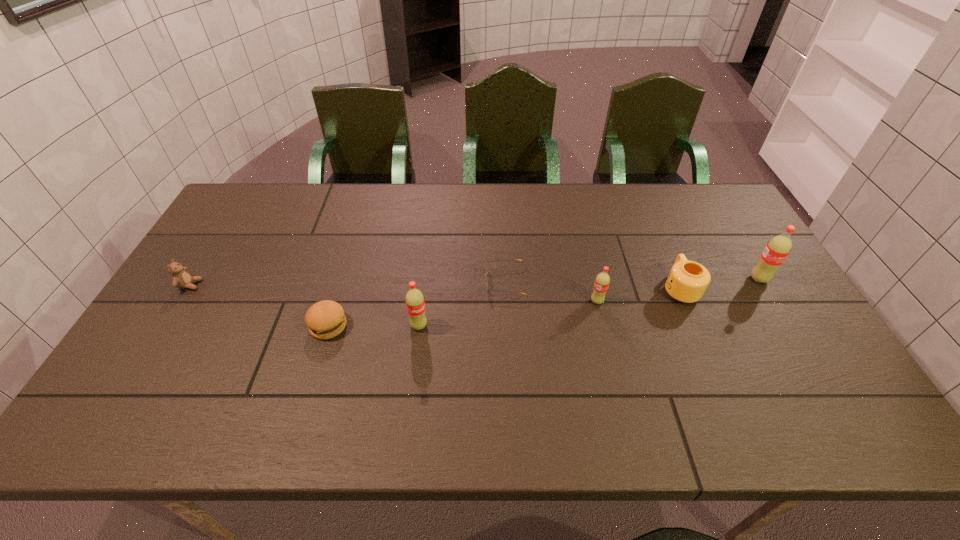
Where is `the leftmost soda`? The image size is (960, 540). the leftmost soda is located at coordinates (415, 304).

The image size is (960, 540). Find the location of `the fifth object from right to left`. the fifth object from right to left is located at coordinates (415, 304).

Image resolution: width=960 pixels, height=540 pixels. What are the coordinates of `the second soda from left to right` in the screenshot? It's located at (602, 281).

Locate an element on the screen. The image size is (960, 540). the second nearest soda is located at coordinates pos(602,281).

This screenshot has width=960, height=540. Find the location of `the rightmost soda`. the rightmost soda is located at coordinates (777, 249).

Where is `the rightmost object`? the rightmost object is located at coordinates (777, 249).

The width and height of the screenshot is (960, 540). Find the location of `the fourth object from left to right`. the fourth object from left to right is located at coordinates (514, 259).

The image size is (960, 540). Find the location of `the shortest object`. the shortest object is located at coordinates (514, 259).

You are a GUI agent. You are given a task and a screenshot of the screen. Output one action in this format:
    pyautogui.click(x=<x>, y=<y>)
    Task: Click on the sixth object from right to left
    
    Given the screenshot: What is the action you would take?
    pyautogui.click(x=325, y=319)

Image resolution: width=960 pixels, height=540 pixels. I want to click on the second shortest object, so click(325, 319).